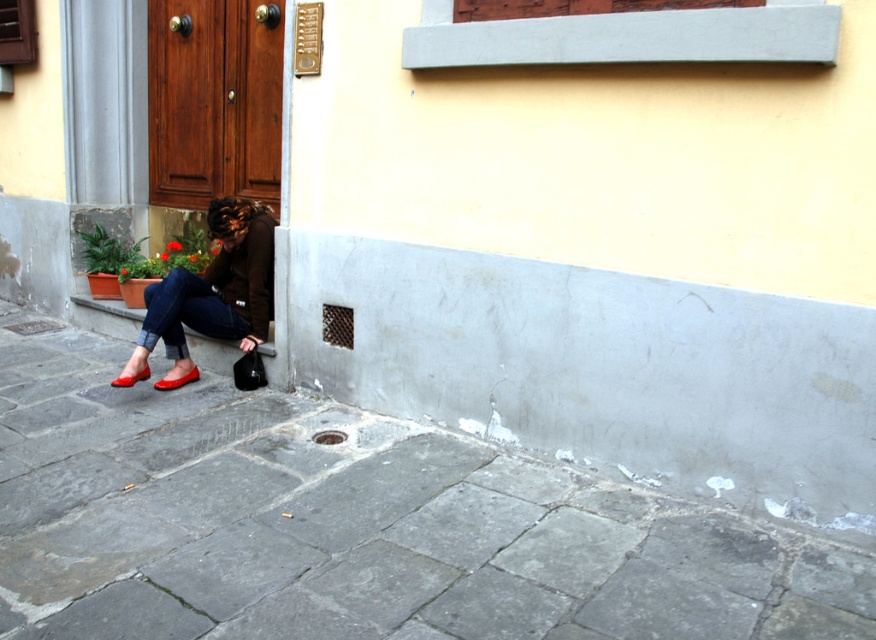
You are a delivery person who needs to place a small package on the ground near the matte black bag at lower left and the matte red shoe at lower left. Which object should you place the package next to if you want it to be closer to the wider object?

The matte black bag at lower left is wider than the matte red shoe at lower left, so you should place the package next to the matte black bag at lower left to be closer to the wider object.

You are a delivery person who needs to place a small package on the ground near the matte black bag at lower left and the matte red shoe at lower left. Which object should you place the package next to if you want it closer to the larger item?

The matte black bag at lower left is bigger than the matte red shoe at lower left, so you should place the package next to the matte black bag at lower left to have it closer to the larger item.

You are a delivery person with a cart that is 5 feet wide. You need to navigate through the space between the gray stone pavement at lower left and the wall. Is there enough space for your cart to pass through?

The space between the gray stone pavement at lower left and the wall is 6.36 feet, which is wider than the cart width of 5 feet. Yes, the cart can pass through.